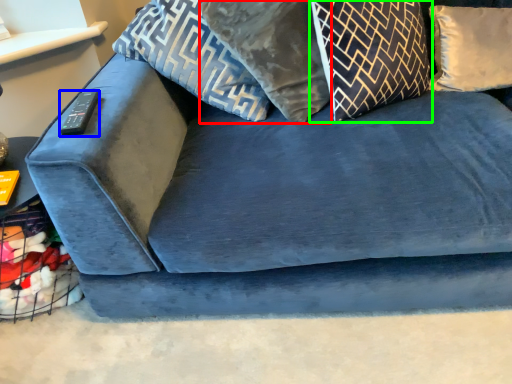
Question: Which is nearer to the pillow (highlighted by a red box)? remote (highlighted by a blue box) or pillow (highlighted by a green box).

Choices:
 (A) remote
 (B) pillow

Answer: (B)